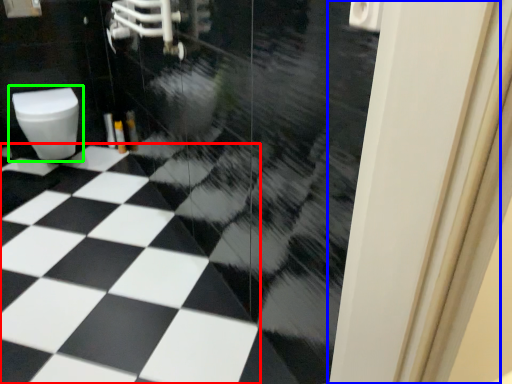
Question: Considering the real-world distances, which object is closest to tile (highlighted by a red box)? screen door (highlighted by a blue box) or toilet (highlighted by a green box).

Choices:
 (A) screen door
 (B) toilet

Answer: (B)